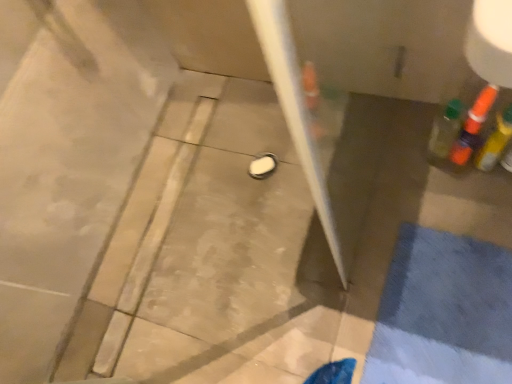
This screenshot has width=512, height=384. In order to click on free space in front of translucent orange bottle at upper right, the second bottle when ordered from right to left in this screenshot , I will do `click(483, 202)`.